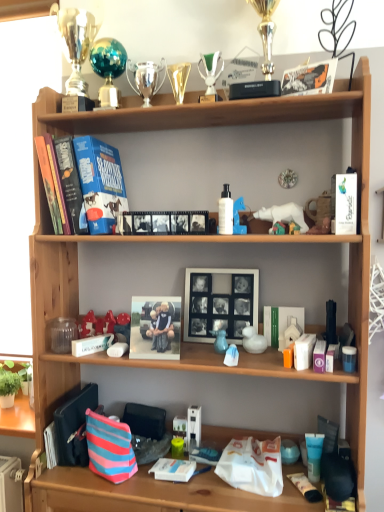
Question: Is white matte picture frame at center turned away from hardcover book at upper left, which is the second paperback book in front-to-back order?

Choices:
 (A) no
 (B) yes

Answer: (A)

Question: Is white matte picture frame at center far away from hardcover book at upper left, positioned as the first paperback book in back-to-front order?

Choices:
 (A) no
 (B) yes

Answer: (A)

Question: Is white matte picture frame at center beside hardcover book at upper left, the first paperback book in the left-to-right sequence?

Choices:
 (A) no
 (B) yes

Answer: (A)

Question: Is white matte picture frame at center positioned beyond the bounds of hardcover book at upper left, positioned as the first paperback book in back-to-front order?

Choices:
 (A) no
 (B) yes

Answer: (B)

Question: Is white matte picture frame at center to the left of hardcover book at upper left, positioned as the first paperback book in back-to-front order, from the viewer's perspective?

Choices:
 (A) yes
 (B) no

Answer: (B)

Question: Is white glossy duck at center, arranged as the third toy when ordered from the bottom, inside or outside of matte plastic photo frame at center?

Choices:
 (A) inside
 (B) outside

Answer: (B)

Question: Considering the positions of point tap(246, 337) and point tap(177, 332), is point tap(246, 337) closer or farther from the camera than point tap(177, 332)?

Choices:
 (A) closer
 (B) farther

Answer: (B)

Question: From a real-world perspective, is white glossy duck at center, arranged as the third toy when ordered from the bottom, above or below matte plastic photo frame at center?

Choices:
 (A) below
 (B) above

Answer: (A)

Question: From the image's perspective, is white glossy duck at center, which is the second toy in right-to-left order, located above or below matte plastic photo frame at center?

Choices:
 (A) below
 (B) above

Answer: (A)

Question: Is point (226, 295) positioned closer to the camera than point (215, 346)?

Choices:
 (A) closer
 (B) farther

Answer: (B)

Question: Which is correct: white matte picture frame at center is inside matte blue rubber duck at middle, the seventh toy positioned from the top, or outside of it?

Choices:
 (A) inside
 (B) outside

Answer: (B)

Question: From a real-world perspective, is white matte picture frame at center physically located above or below matte blue rubber duck at middle, the seventh toy positioned from the top?

Choices:
 (A) above
 (B) below

Answer: (A)

Question: In terms of width, does white matte picture frame at center look wider or thinner when compared to matte blue rubber duck at middle, the seventh toy positioned from the top?

Choices:
 (A) thin
 (B) wide

Answer: (B)

Question: In terms of size, does white matte paperback book at upper right, the 1th paperback book in the front-to-back sequence, appear bigger or smaller than matte plastic tube at lower right, the third toiletry positioned from the right?

Choices:
 (A) big
 (B) small

Answer: (A)

Question: Is white matte paperback book at upper right, placed as the first paperback book when sorted from right to left, wider or thinner than matte plastic tube at lower right, the 4th toiletry positioned from the top?

Choices:
 (A) thin
 (B) wide

Answer: (A)